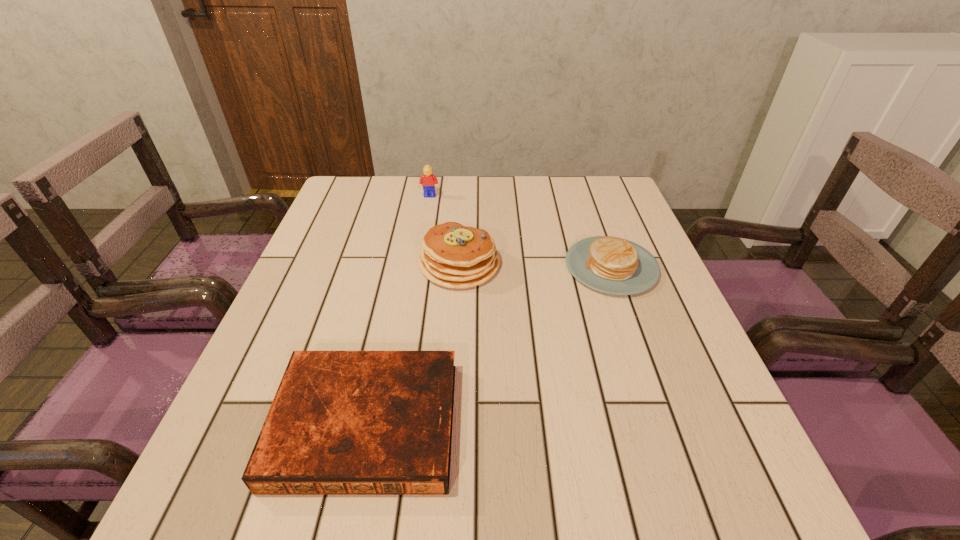
Identify which object is the second closest to the left pancake. Please provide its 2D coordinates. Your answer should be formatted as a tuple, i.e. [(x, y)], where the tuple contains the x and y coordinates of a point satisfying the conditions above.

[(342, 422)]

Identify the location of vacant area in the image that satisfies the following two spatial constraints: 1. on the front-facing side of the Lego; 2. on the left side of the taller pancake. (419, 265).

The height and width of the screenshot is (540, 960). What are the coordinates of `blank area in the image that satisfies the following two spatial constraints: 1. on the front-facing side of the left pancake; 2. on the left side of the farthest object` in the screenshot? It's located at (419, 265).

You are a GUI agent. You are given a task and a screenshot of the screen. Output one action in this format:
    pyautogui.click(x=<x>, y=<y>)
    Task: Click on the vacant area that satisfies the following two spatial constraints: 1. on the front-facing side of the shorter pancake; 2. on the left side of the Lego
    
    Given the screenshot: What is the action you would take?
    pyautogui.click(x=419, y=267)

The image size is (960, 540). What are the coordinates of `free spot that satisfies the following two spatial constraints: 1. on the front-facing side of the farthest object; 2. on the right side of the rightmost object` in the screenshot? It's located at (419, 267).

You are a GUI agent. You are given a task and a screenshot of the screen. Output one action in this format:
    pyautogui.click(x=<x>, y=<y>)
    Task: Click on the vacant space that satisfies the following two spatial constraints: 1. on the front-facing side of the left pancake; 2. on the right side of the Lego
    The height and width of the screenshot is (540, 960).
    Given the screenshot: What is the action you would take?
    pyautogui.click(x=419, y=265)

The image size is (960, 540). I want to click on free spot that satisfies the following two spatial constraints: 1. on the front-facing side of the left pancake; 2. on the right side of the Lego, so click(419, 265).

The height and width of the screenshot is (540, 960). Identify the location of free location that satisfies the following two spatial constraints: 1. on the front-facing side of the left pancake; 2. on the left side of the Lego. [x=419, y=265].